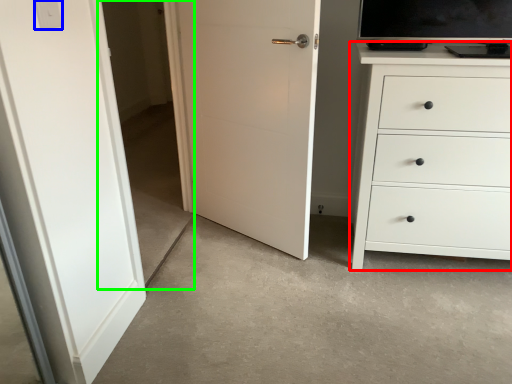
Question: Estimate the real-world distances between objects in this image. Which object is closer to chest of drawers (highlighted by a red box), light switch (highlighted by a blue box) or glass door (highlighted by a green box)?

Choices:
 (A) light switch
 (B) glass door

Answer: (A)